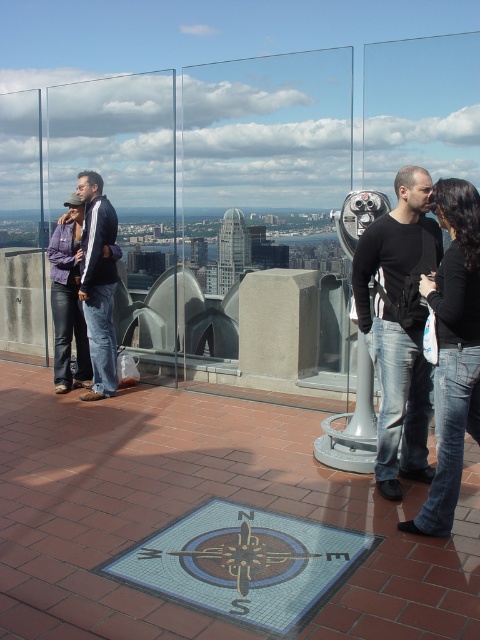
This screenshot has width=480, height=640. I want to click on black matte shirt at center, so click(x=399, y=326).

Between black matte shirt at center and black matte jeans at right, which one is positioned higher?

black matte shirt at center

Identify the location of black matte shirt at center. The image size is (480, 640). (399, 326).

Between black matte shirt at center and matte black jacket at left, which one appears on the right side from the viewer's perspective?

Positioned to the right is black matte shirt at center.

Who is positioned more to the left, black matte shirt at center or matte black jacket at left?

matte black jacket at left

Where is `black matte shirt at center`? black matte shirt at center is located at coordinates [x=399, y=326].

Is black matte jeans at right wider than matte black jacket at left?

Yes.

Consider the image. Between black matte jeans at right and matte black jacket at left, which one appears on the left side from the viewer's perspective?

Positioned to the left is matte black jacket at left.

Is point (433, 314) closer to camera compared to point (91, 208)?

Yes, point (433, 314) is closer to viewer.

This screenshot has width=480, height=640. I want to click on black matte jeans at right, so click(x=453, y=349).